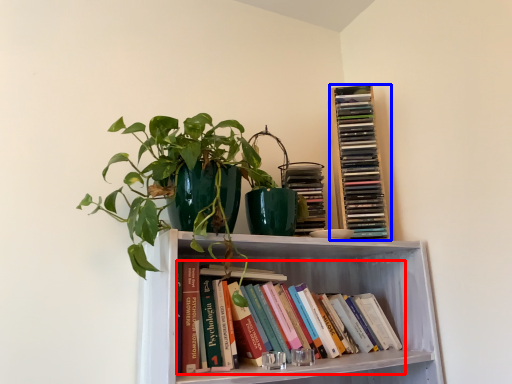
Question: Which object appears farthest to the camera in this image, book (highlighted by a red box) or book (highlighted by a blue box)?

Choices:
 (A) book
 (B) book

Answer: (B)